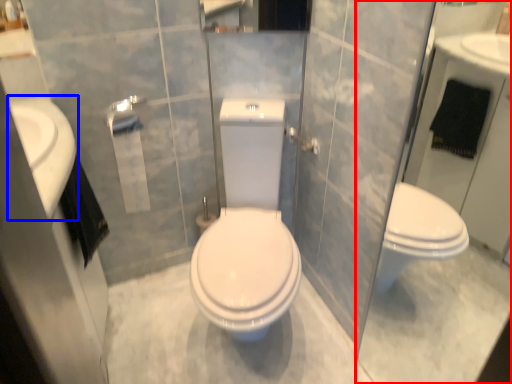
Question: Which point is closer to the camera, glass door (highlighted by a red box) or sink (highlighted by a blue box)?

Choices:
 (A) glass door
 (B) sink

Answer: (A)